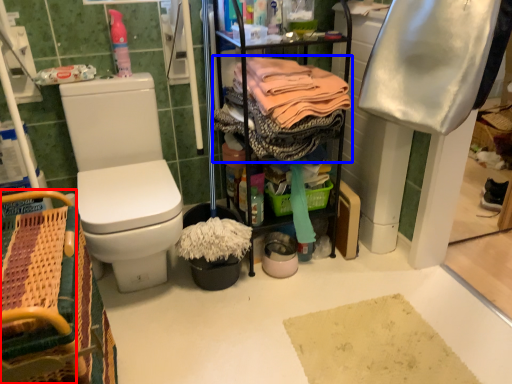
Question: Which of the following is the closest to the observer, picnic basket (highlighted by a red box) or clothing (highlighted by a blue box)?

Choices:
 (A) picnic basket
 (B) clothing

Answer: (A)